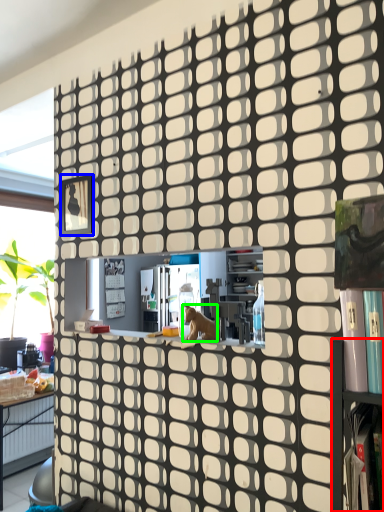
Question: Which is nearer to the shelf (highlighted by a red box)? square (highlighted by a blue box) or animal (highlighted by a green box).

Choices:
 (A) square
 (B) animal

Answer: (B)